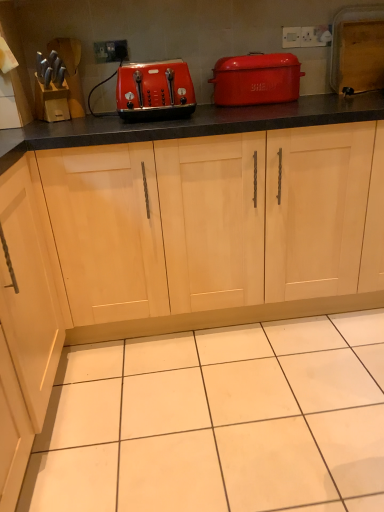
Question: Does white plastic electric outlet at upper center come behind matte plastic toaster at center?

Choices:
 (A) yes
 (B) no

Answer: (A)

Question: From a real-world perspective, is white plastic electric outlet at upper center positioned over matte plastic toaster at center based on gravity?

Choices:
 (A) yes
 (B) no

Answer: (A)

Question: Does white plastic electric outlet at upper center lie in front of matte plastic toaster at center?

Choices:
 (A) yes
 (B) no

Answer: (B)

Question: Is white plastic electric outlet at upper center completely or partially outside of matte plastic toaster at center?

Choices:
 (A) yes
 (B) no

Answer: (A)

Question: Does white plastic electric outlet at upper center have a greater width compared to matte plastic toaster at center?

Choices:
 (A) no
 (B) yes

Answer: (A)

Question: Is point click(258, 257) closer or farther from the camera than point click(266, 77)?

Choices:
 (A) farther
 (B) closer

Answer: (B)

Question: Would you say light wood cabinet at center is inside or outside matte red bread bin at upper center?

Choices:
 (A) outside
 (B) inside

Answer: (A)

Question: Visually, is light wood cabinet at center positioned to the left or to the right of matte red bread bin at upper center?

Choices:
 (A) right
 (B) left

Answer: (B)

Question: From a real-world perspective, relative to matte red bread bin at upper center, is light wood cabinet at center vertically above or below?

Choices:
 (A) below
 (B) above

Answer: (A)

Question: From the image's perspective, is light wood cabinet at center located above or below matte plastic toaster at center?

Choices:
 (A) above
 (B) below

Answer: (B)

Question: In terms of height, does light wood cabinet at center look taller or shorter compared to matte plastic toaster at center?

Choices:
 (A) tall
 (B) short

Answer: (A)

Question: Based on their sizes in the image, would you say light wood cabinet at center is bigger or smaller than matte plastic toaster at center?

Choices:
 (A) big
 (B) small

Answer: (A)

Question: Is light wood cabinet at center inside or outside of matte plastic toaster at center?

Choices:
 (A) outside
 (B) inside

Answer: (A)

Question: Is matte red bread bin at upper center spatially inside light wood cabinet at center, or outside of it?

Choices:
 (A) inside
 (B) outside

Answer: (B)

Question: Considering the relative positions of matte red bread bin at upper center and light wood cabinet at center in the image provided, is matte red bread bin at upper center to the left or to the right of light wood cabinet at center?

Choices:
 (A) right
 (B) left

Answer: (A)